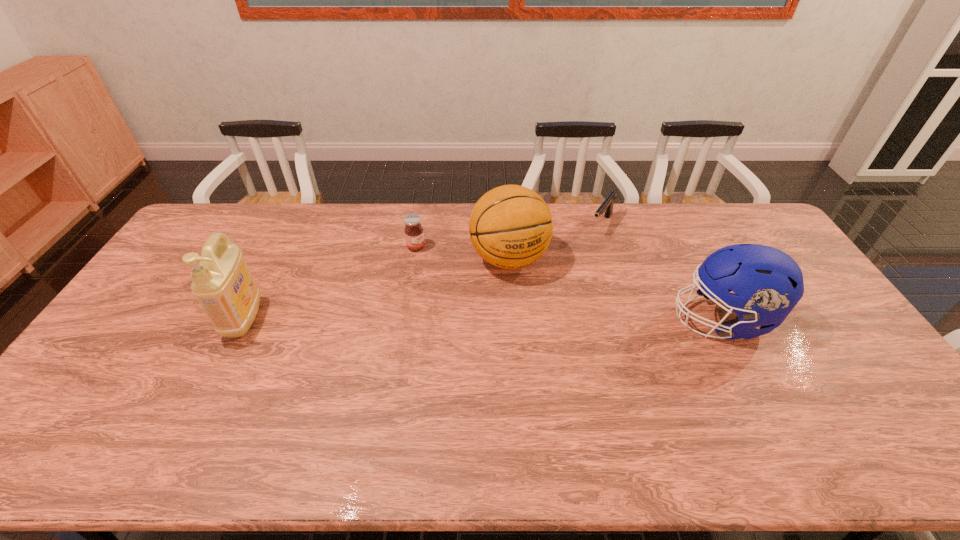
Where is `blank area located 0.170m on the label side of the second object from left to right`? The image size is (960, 540). blank area located 0.170m on the label side of the second object from left to right is located at coordinates (459, 273).

Where is `vacant space located 0.060m on the label side of the second object from left to right`? The height and width of the screenshot is (540, 960). vacant space located 0.060m on the label side of the second object from left to right is located at coordinates (435, 258).

This screenshot has width=960, height=540. Find the location of `free space located on the surface of the basketball near the brand logo`. free space located on the surface of the basketball near the brand logo is located at coordinates (576, 393).

Image resolution: width=960 pixels, height=540 pixels. I want to click on vacant space located 0.140m on the surface of the basketball near the brand logo, so click(539, 318).

Identify the location of vacant space located on the surface of the basketball near the brand logo. (547, 336).

Identify the location of vacant space situated 0.090m at the muzzle of the fourth object from left to right. (587, 251).

Find the location of a particular element. This screenshot has width=960, height=540. vacant space positioned 0.160m at the muzzle of the fourth object from left to right is located at coordinates (578, 262).

The height and width of the screenshot is (540, 960). What are the coordinates of `vacant region located at the muzzle of the fourth object from left to right` in the screenshot? It's located at (570, 272).

Locate an element on the screen. Image resolution: width=960 pixels, height=540 pixels. jam at the far edge is located at coordinates (414, 234).

Image resolution: width=960 pixels, height=540 pixels. Identify the location of basketball at the far edge. (510, 226).